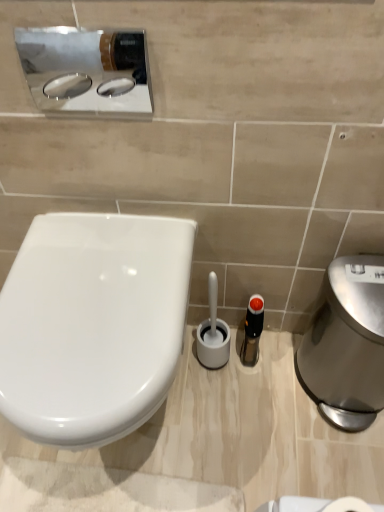
This screenshot has width=384, height=512. In order to click on vacant space in front of translucent plastic bottle at center in this screenshot , I will do `click(256, 409)`.